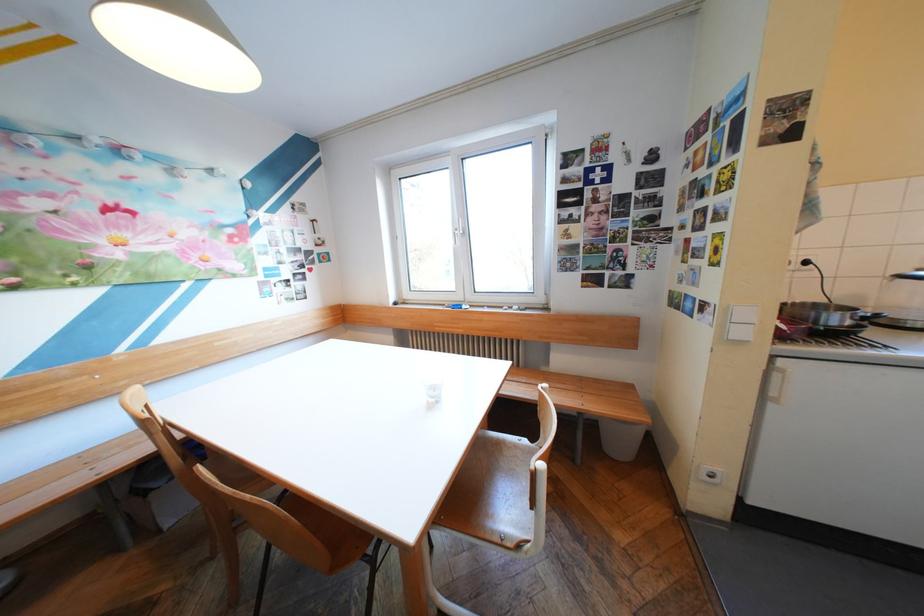
What do you see at coordinates (457, 229) in the screenshot?
I see `the white window handle` at bounding box center [457, 229].